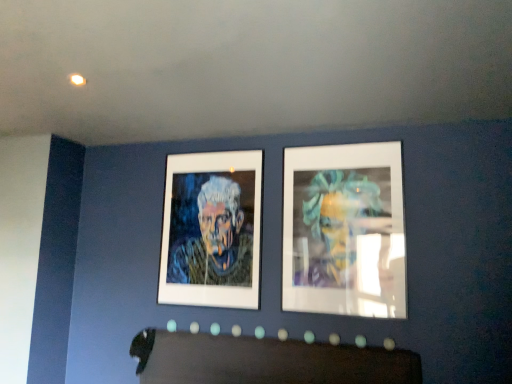
Image resolution: width=512 pixels, height=384 pixels. Describe the element at coordinates (344, 230) in the screenshot. I see `white matte picture frame at upper right` at that location.

Where is `white matte picture frame at upper right`? The image size is (512, 384). white matte picture frame at upper right is located at coordinates (344, 230).

Identify the location of oil painting portrait at center. pos(210,233).

The height and width of the screenshot is (384, 512). What do you see at coordinates (210, 233) in the screenshot?
I see `oil painting portrait at center` at bounding box center [210, 233].

In order to face oil painting portrait at center, should I rotate leftwards or rightwards?

Turn left by 6.096 degrees to look at oil painting portrait at center.

Locate an element on the screen. white matte picture frame at upper right is located at coordinates (344, 230).

Between white matte picture frame at upper right and oil painting portrait at center, which one appears on the left side from the viewer's perspective?

From the viewer's perspective, oil painting portrait at center appears more on the left side.

Which object is closer to the camera, white matte picture frame at upper right or oil painting portrait at center?

Positioned in front is white matte picture frame at upper right.

Does point (330, 155) lie behind point (243, 246)?

No, (330, 155) is in front of (243, 246).

From the image's perspective, is white matte picture frame at upper right located above or below oil painting portrait at center?

white matte picture frame at upper right is above oil painting portrait at center.

From a real-world perspective, which is physically above, white matte picture frame at upper right or oil painting portrait at center?

white matte picture frame at upper right.

Which of these two, white matte picture frame at upper right or oil painting portrait at center, is thinner?

Thinner between the two is oil painting portrait at center.

Which of these two, white matte picture frame at upper right or oil painting portrait at center, stands shorter?

With less height is oil painting portrait at center.

Does white matte picture frame at upper right have a larger size compared to oil painting portrait at center?

Yes, white matte picture frame at upper right is bigger than oil painting portrait at center.

Would you say white matte picture frame at upper right contains oil painting portrait at center?

No.

Looking at this image, is there a large distance between white matte picture frame at upper right and oil painting portrait at center?

No, white matte picture frame at upper right is in close proximity to oil painting portrait at center.

Does white matte picture frame at upper right turn towards oil painting portrait at center?

No, white matte picture frame at upper right is not turned towards oil painting portrait at center.

How many degrees apart are the facing directions of white matte picture frame at upper right and oil painting portrait at center?

The facing directions of white matte picture frame at upper right and oil painting portrait at center are 0.000315 degrees apart.

Where is `picture frame in front of the oil painting portrait at center`? This screenshot has width=512, height=384. picture frame in front of the oil painting portrait at center is located at coordinates (344, 230).

Which object is positioned more to the right, oil painting portrait at center or white matte picture frame at upper right?

From the viewer's perspective, white matte picture frame at upper right appears more on the right side.

In the scene shown: Is oil painting portrait at center in front of or behind white matte picture frame at upper right in the image?

oil painting portrait at center is behind white matte picture frame at upper right.

Is point (172, 246) closer to viewer compared to point (293, 205)?

No, it is not.

From the picture: From the image's perspective, which object appears higher, oil painting portrait at center or white matte picture frame at upper right?

white matte picture frame at upper right appears higher in the image.

From the picture: From a real-world perspective, is oil painting portrait at center positioned above or below white matte picture frame at upper right?

In terms of real-world spatial position, oil painting portrait at center is below white matte picture frame at upper right.

Which of these two, oil painting portrait at center or white matte picture frame at upper right, is thinner?

oil painting portrait at center is thinner.

Who is shorter, oil painting portrait at center or white matte picture frame at upper right?

oil painting portrait at center.

In terms of size, does oil painting portrait at center appear bigger or smaller than white matte picture frame at upper right?

Clearly, oil painting portrait at center is smaller in size than white matte picture frame at upper right.

Do you think oil painting portrait at center is within white matte picture frame at upper right, or outside of it?

oil painting portrait at center is not enclosed by white matte picture frame at upper right.

In the scene shown: Is oil painting portrait at center placed right next to white matte picture frame at upper right?

No, oil painting portrait at center is not next to white matte picture frame at upper right.

Consider the image. Could you tell me if oil painting portrait at center is turned towards white matte picture frame at upper right?

No, oil painting portrait at center does not turn towards white matte picture frame at upper right.

How different are the orientations of oil painting portrait at center and white matte picture frame at upper right in degrees?

The angle between the facing direction of oil painting portrait at center and the facing direction of white matte picture frame at upper right is 0.000315 degrees.

Looking at this image, measure the distance between oil painting portrait at center and white matte picture frame at upper right.

oil painting portrait at center and white matte picture frame at upper right are 22.19 inches apart from each other.

The height and width of the screenshot is (384, 512). What are the coordinates of `person below the white matte picture frame at upper right (from a real-world perspective)` in the screenshot? It's located at (210, 233).

Locate an element on the screen. The height and width of the screenshot is (384, 512). picture frame that is on the right side of oil painting portrait at center is located at coordinates [x=344, y=230].

Identify the location of picture frame above the oil painting portrait at center (from a real-world perspective). (344, 230).